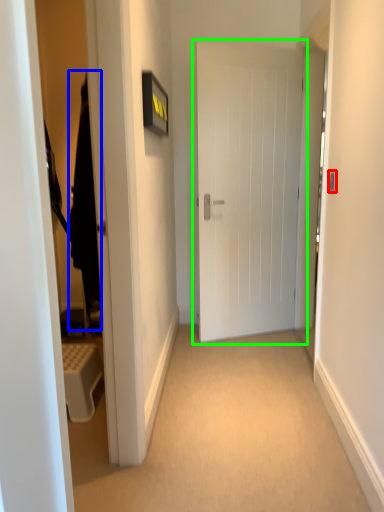
Question: Based on their relative distances, which object is nearer to door handle (highlighted by a red box)? Choose from robe (highlighted by a blue box) and door (highlighted by a green box).

Choices:
 (A) robe
 (B) door

Answer: (A)